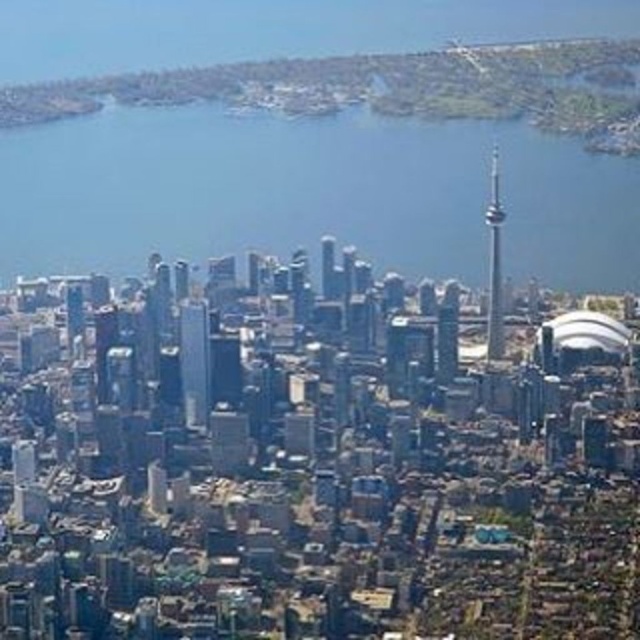
You are a drone operator flying a drone over the city. Your drone is currently above the blue water at center. You want to capture a photo of the smooth glass tower at center. Can you fly directly towards it without any obstruction? Explain why or why not based on their positions.

The blue water at center is closer to the viewer than the smooth glass tower at center, so the drone would need to fly away from its current position towards the tower since the tower is further back. There might be no obstruction if the path is clear, but the question doesn

You are a drone operator flying over the city. You notice the blue water at center and the glassy reflective skyscraper at center. Which one appears taller from your aerial view?

The blue water at center has a greater height compared to the glassy reflective skyscraper at center, so the blue water at center appears taller from the aerial view.